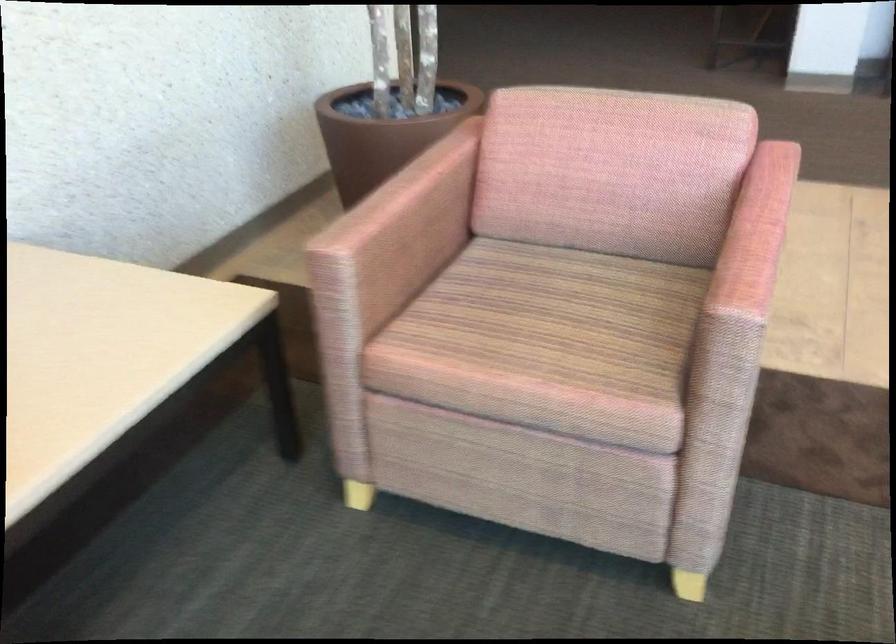
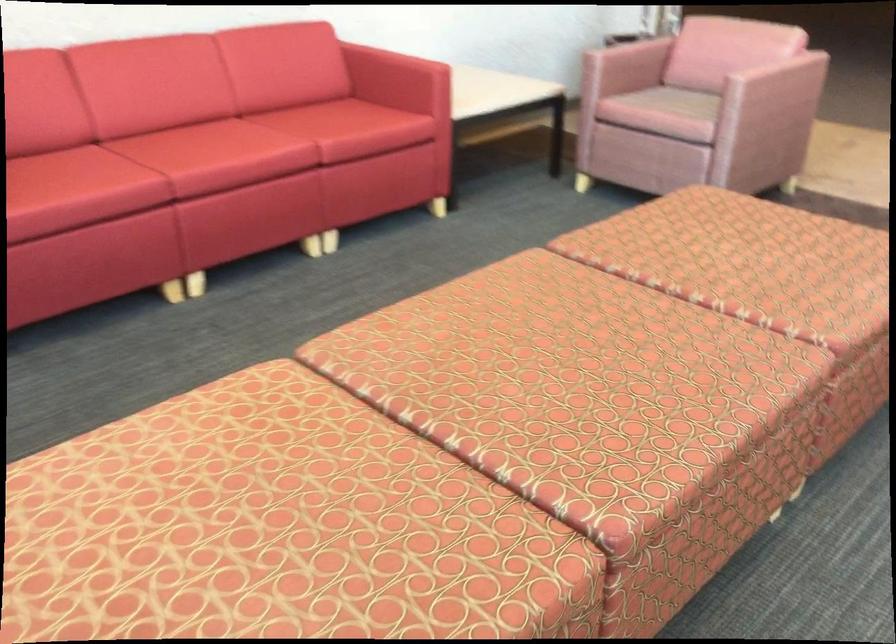
Locate, in the second image, the point that corresponds to [558,303] in the first image.

(686, 102)